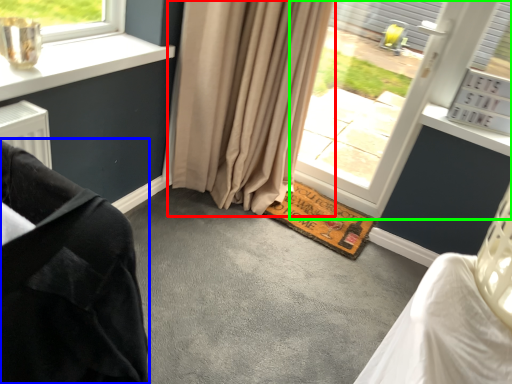
Question: Estimate the real-world distances between objects in this image. Which object is closer to curtain (highlighted by a red box), furniture (highlighted by a blue box) or window (highlighted by a green box)?

Choices:
 (A) furniture
 (B) window

Answer: (B)